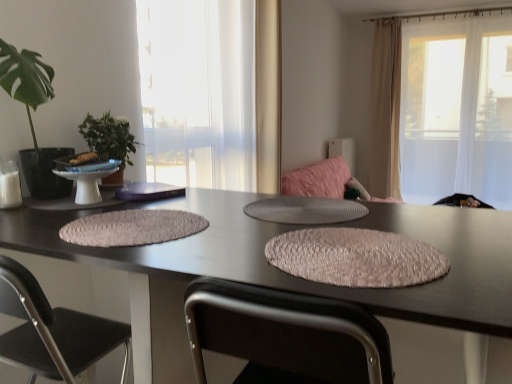
Question: Considering the relative sizes of textured beige placemat at center, which is the 2th yoga mat in right-to-left order, and green leafy plant at left, which appears as the 1th houseplant when viewed from the back, in the image provided, is textured beige placemat at center, which is the 2th yoga mat in right-to-left order, wider than green leafy plant at left, which appears as the 1th houseplant when viewed from the back,?

Choices:
 (A) no
 (B) yes

Answer: (B)

Question: Are textured beige placemat at center, which is the 2th yoga mat in right-to-left order, and green leafy plant at left, positioned as the second houseplant in front-to-back order, located far from each other?

Choices:
 (A) no
 (B) yes

Answer: (A)

Question: From a real-world perspective, is textured beige placemat at center, which is counted as the 1th yoga mat, starting from the left, physically below green leafy plant at left, which appears as the 1th houseplant when viewed from the back?

Choices:
 (A) yes
 (B) no

Answer: (A)

Question: Is textured beige placemat at center, which is counted as the 1th yoga mat, starting from the left, oriented away from green leafy plant at left, positioned as the second houseplant in front-to-back order?

Choices:
 (A) no
 (B) yes

Answer: (A)

Question: From a real-world perspective, is textured beige placemat at center, which is the 2th yoga mat in right-to-left order, located higher than green leafy plant at left, positioned as the second houseplant in front-to-back order?

Choices:
 (A) yes
 (B) no

Answer: (B)

Question: Is textured beige placemat at center, the second yoga mat in the left-to-right sequence, bigger or smaller than textured beige placemat at center, which is the 2th yoga mat in right-to-left order?

Choices:
 (A) small
 (B) big

Answer: (B)

Question: In terms of height, does textured beige placemat at center, the second yoga mat in the left-to-right sequence, look taller or shorter compared to textured beige placemat at center, which is counted as the 1th yoga mat, starting from the left?

Choices:
 (A) tall
 (B) short

Answer: (A)

Question: From the image's perspective, is textured beige placemat at center, arranged as the 1th yoga mat when viewed from the right, located above or below textured beige placemat at center, which is the 2th yoga mat in right-to-left order?

Choices:
 (A) below
 (B) above

Answer: (A)

Question: Considering the positions of point (411, 279) and point (84, 244), is point (411, 279) closer or farther from the camera than point (84, 244)?

Choices:
 (A) farther
 (B) closer

Answer: (B)

Question: From a real-world perspective, relative to matte black table at center, is beige fabric curtain at upper right vertically above or below?

Choices:
 (A) below
 (B) above

Answer: (B)

Question: Is point (390, 163) closer or farther from the camera than point (146, 269)?

Choices:
 (A) farther
 (B) closer

Answer: (A)

Question: Is beige fabric curtain at upper right wider or thinner than matte black table at center?

Choices:
 (A) thin
 (B) wide

Answer: (A)

Question: Is beige fabric curtain at upper right bigger or smaller than matte black table at center?

Choices:
 (A) small
 (B) big

Answer: (A)

Question: Is matte black table at center inside the boundaries of green leafy plant at left, positioned as the first houseplant in front-to-back order, or outside?

Choices:
 (A) outside
 (B) inside

Answer: (A)

Question: Looking at the image, does matte black table at center seem bigger or smaller compared to green leafy plant at left, which appears as the second houseplant when viewed from the back?

Choices:
 (A) small
 (B) big

Answer: (B)